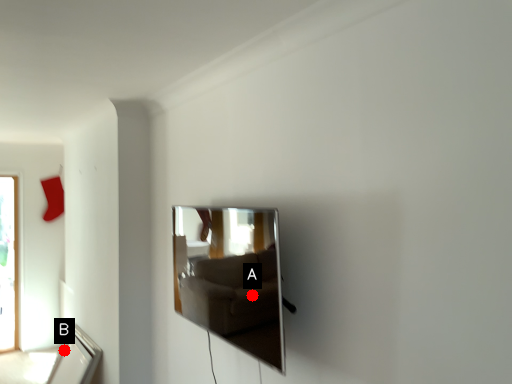
Question: Two points are circled on the image, labeled by A and B beside each circle. Which point is further to the camera?

Choices:
 (A) A is further
 (B) B is further

Answer: (B)